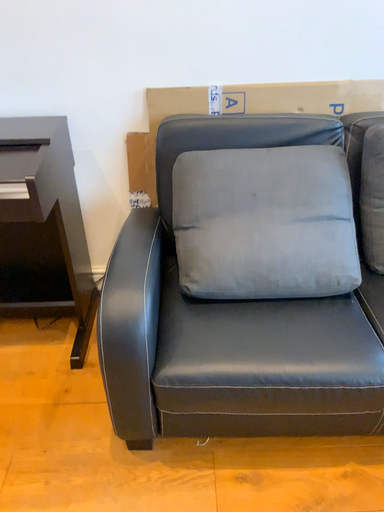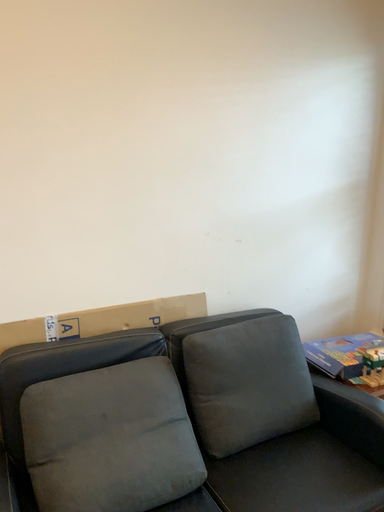
Question: Which way did the camera rotate in the video?

Choices:
 (A) rotated left
 (B) rotated right

Answer: (B)